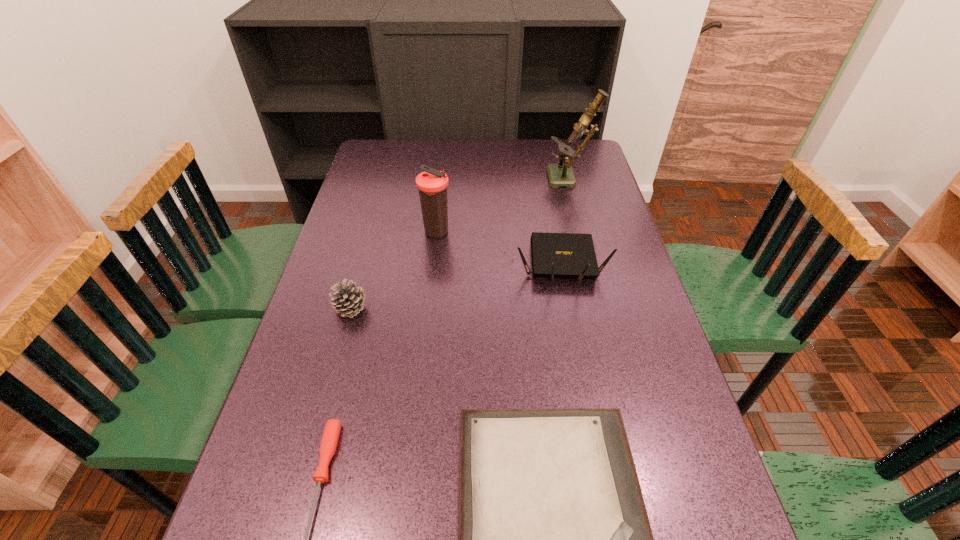
I want to click on free region located 0.270m on the front of the third object from left to right, so click(x=428, y=313).

Identify the location of free region located 0.260m on the front of the router. (582, 381).

Find the location of a particular element. The width and height of the screenshot is (960, 540). vacant space located on the back of the third shortest object is located at coordinates pos(372,233).

In order to click on object that is at the far edge in this screenshot , I will do `click(560, 174)`.

The height and width of the screenshot is (540, 960). What are the coordinates of `object at the left edge` in the screenshot? It's located at (347, 299).

Identify the location of microscope that is at the right edge. This screenshot has height=540, width=960. (560, 174).

Identify the location of router positioned at the right edge. The image size is (960, 540). (554, 255).

Locate an element on the screen. This screenshot has height=540, width=960. object located at the far right corner is located at coordinates (560, 174).

The image size is (960, 540). In the image, there is a desktop. In order to click on vacant space at the left edge in this screenshot , I will do `click(228, 524)`.

Locate an element on the screen. vacant space at the right edge is located at coordinates (587, 197).